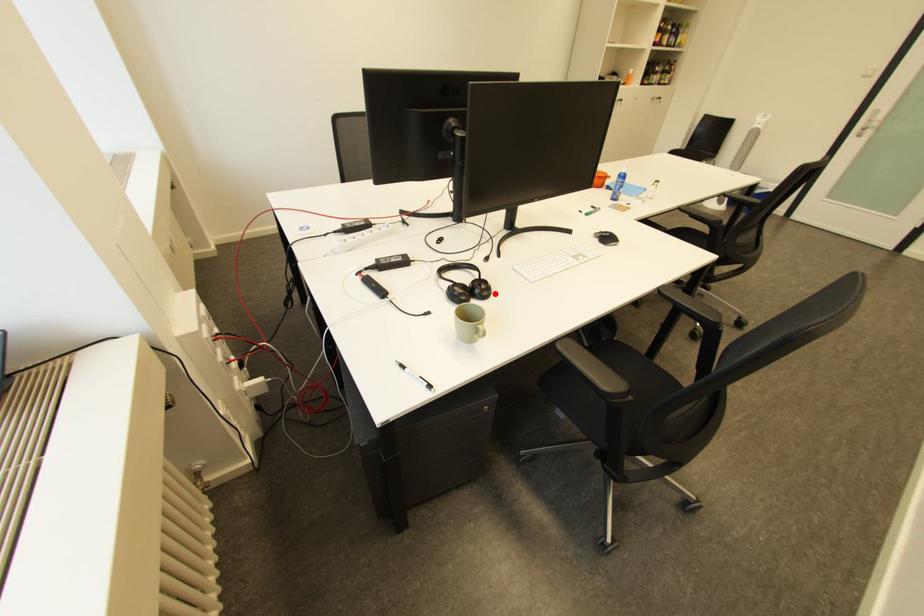
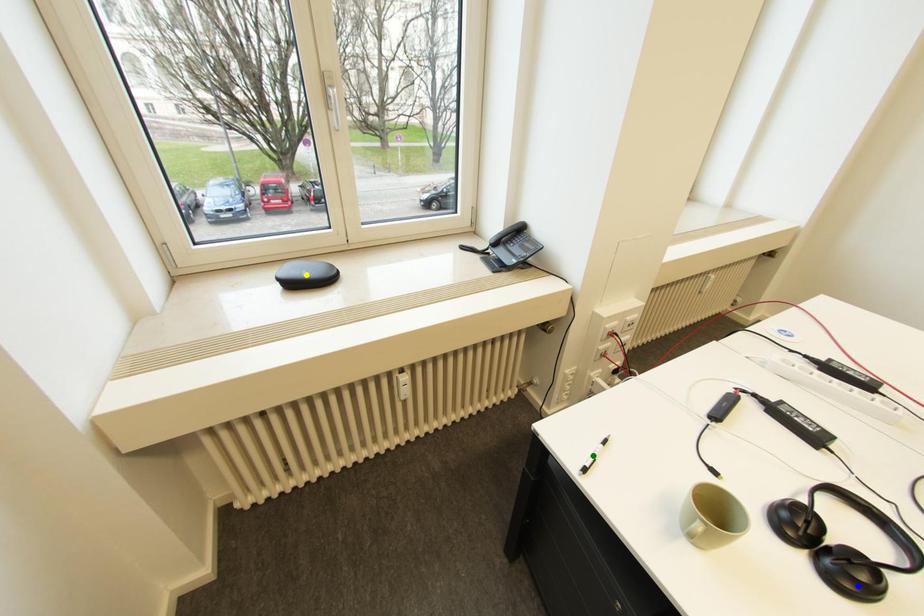
Question: I am providing you with two images of the same scene from different viewpoints. A red point is marked on the first image. You are given multiple points on the second image. Can you choose the point in image 2 that corresponds to the point in image 1?

Choices:
 (A) yellow point
 (B) green point
 (C) blue point

Answer: (C)